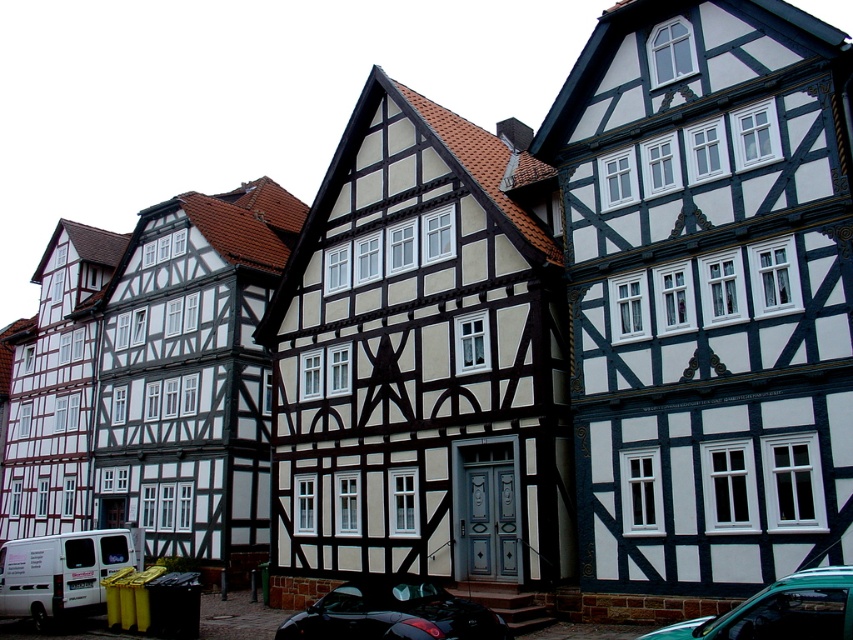
Question: Which object is farther from the camera taking this photo?

Choices:
 (A) shiny black car at lower center
 (B) teal matte car at lower right

Answer: (A)

Question: Can you confirm if shiny black car at lower center is positioned to the right of teal matte car at lower right?

Choices:
 (A) no
 (B) yes

Answer: (A)

Question: Can you confirm if shiny black car at lower center is smaller than teal matte car at lower right?

Choices:
 (A) no
 (B) yes

Answer: (A)

Question: Which of the following is the farthest from the observer?

Choices:
 (A) teal matte car at lower right
 (B) shiny black car at lower center

Answer: (B)

Question: Can you confirm if shiny black car at lower center is bigger than teal matte car at lower right?

Choices:
 (A) yes
 (B) no

Answer: (A)